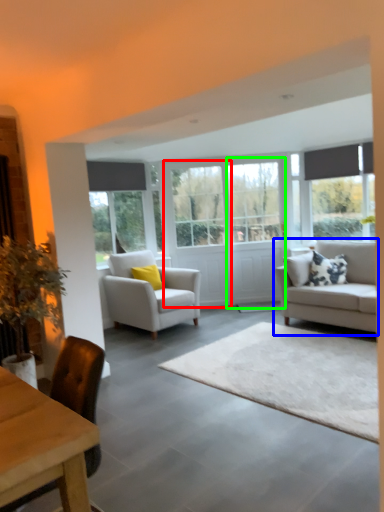
Question: Which is farther away from glass door (highlighted by a red box)? studio couch (highlighted by a blue box) or glass door (highlighted by a green box)?

Choices:
 (A) studio couch
 (B) glass door

Answer: (A)